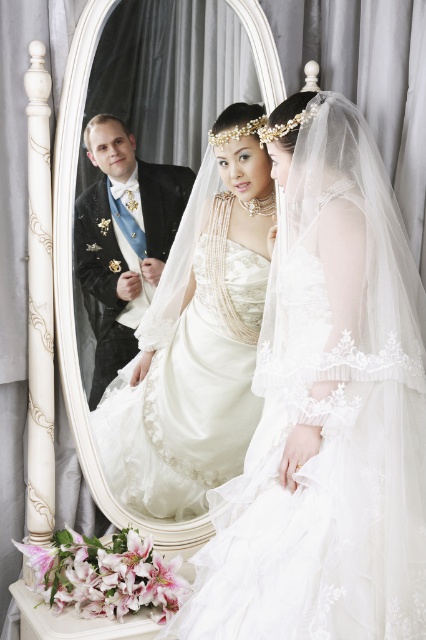
You are a photographer planning to capture a portrait of the two individuals in the scene. Given that the white lace dress at center is larger than the black satin tuxedo at left, how should you position the subjects to ensure both are clearly visible in the frame?

Since the white lace dress at center is larger than the black satin tuxedo at left, position the subject in the white lace dress at center slightly closer to the camera or adjust the framing to accommodate the wider silhouette of the dress while keeping both subjects within the shot.

You are standing at a distance and want to take a photo of the point at coordinates point (230,444). If you need to be within 8 feet to get a clear shot, can you take the photo from your current position?

The point (230,444) is 8.27 feet away from the viewer, which is slightly beyond the 8 feet requirement. Therefore, you cannot take a clear photo from your current position.